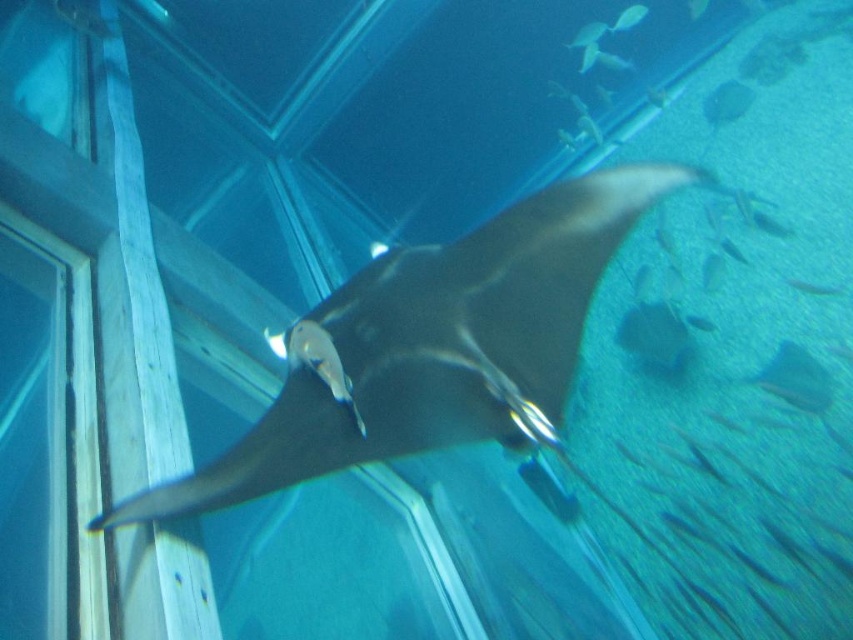
You are an aquarium visitor standing in front of the glass wall. You see the shiny black stingray at center and the translucent white fish at upper center. Which one is closer to your left side?

The shiny black stingray at center is positioned on the left side of translucent white fish at upper center, so it is closer to your left side.

You are an aquarium visitor looking at the translucent white fish at upper center and the translucent blue fish at upper center. Which one is located to the left of the other?

The translucent white fish at upper center is positioned on the left side of the translucent blue fish at upper center.

You are standing in front of the aquarium and want to take a photo of the translucent white fish at upper center. Your camera is 14 feet away from the fish. Is the camera close enough to take a clear photo?

The translucent white fish at upper center and camera are 14.11 feet apart from each other. Since the camera is 14 feet away, it is close enough to take a clear photo.